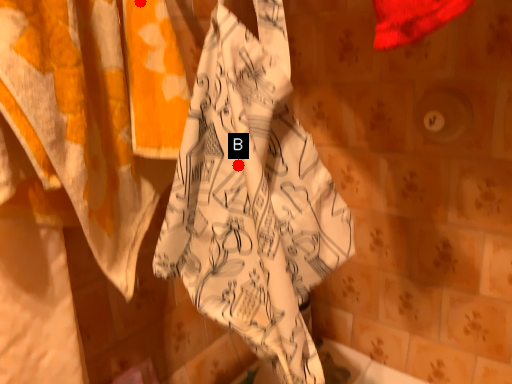
Question: Two points are circled on the image, labeled by A and B beside each circle. Which point appears closest to the camera in this image?

Choices:
 (A) A is closer
 (B) B is closer

Answer: (B)